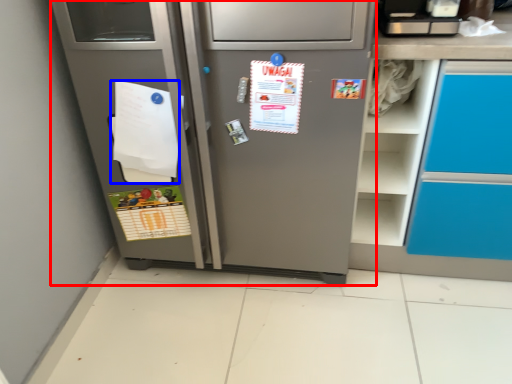
Question: Which object is further to the camera taking this photo, refrigerator (highlighted by a red box) or paper (highlighted by a blue box)?

Choices:
 (A) refrigerator
 (B) paper

Answer: (B)